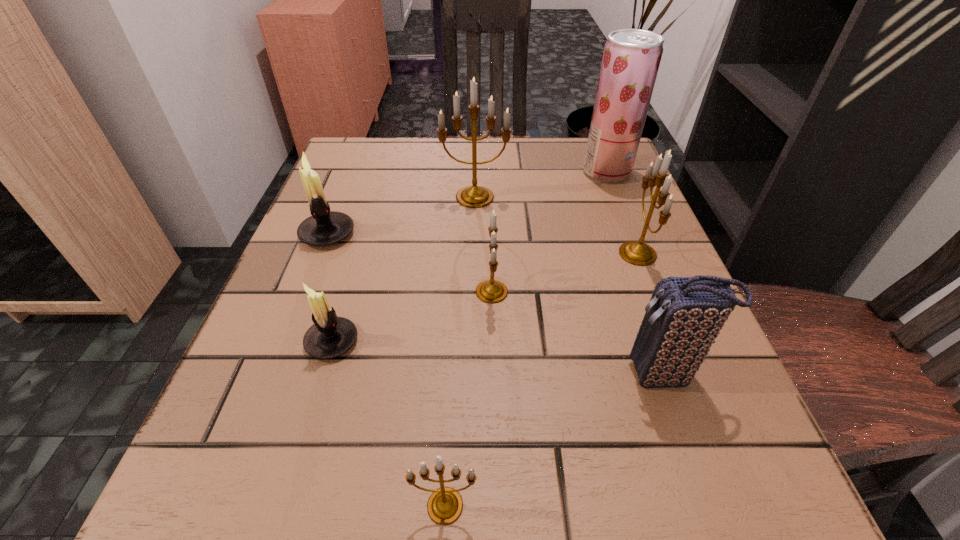
Image resolution: width=960 pixels, height=540 pixels. I want to click on blank region between the third biggest gold candelabrum and the clutch bag, so click(578, 333).

Image resolution: width=960 pixels, height=540 pixels. I want to click on blank region between the smallest gold candelabrum and the clutch bag, so click(x=555, y=440).

Identify the location of vacant space in between the nearest object and the farther white candle holder. This screenshot has height=540, width=960. (386, 370).

Locate an element on the screen. free spot between the nearest object and the rightmost gold candelabrum is located at coordinates (541, 380).

Image resolution: width=960 pixels, height=540 pixels. I want to click on free space between the farther white candle holder and the clutch bag, so click(x=495, y=304).

Where is `free point between the farthest object and the third biggest gold candelabrum`? The image size is (960, 540). free point between the farthest object and the third biggest gold candelabrum is located at coordinates (549, 232).

Locate an element on the screen. The image size is (960, 540). the sixth closest object to the nearest candelabrum is located at coordinates (474, 196).

Identify the location of object that stands as the fifth closest to the bigger white candle holder. (631, 58).

Locate an element on the screen. The width and height of the screenshot is (960, 540). candelabrum that is the second closest to the clutch bag is located at coordinates (491, 291).

Point out which candelabrum is positioned as the fourth nearest to the rightmost gold candelabrum. Please provide its 2D coordinates. Your answer should be formatted as a tuple, i.e. [(x, y)], where the tuple contains the x and y coordinates of a point satisfying the conditions above.

[(330, 336)]